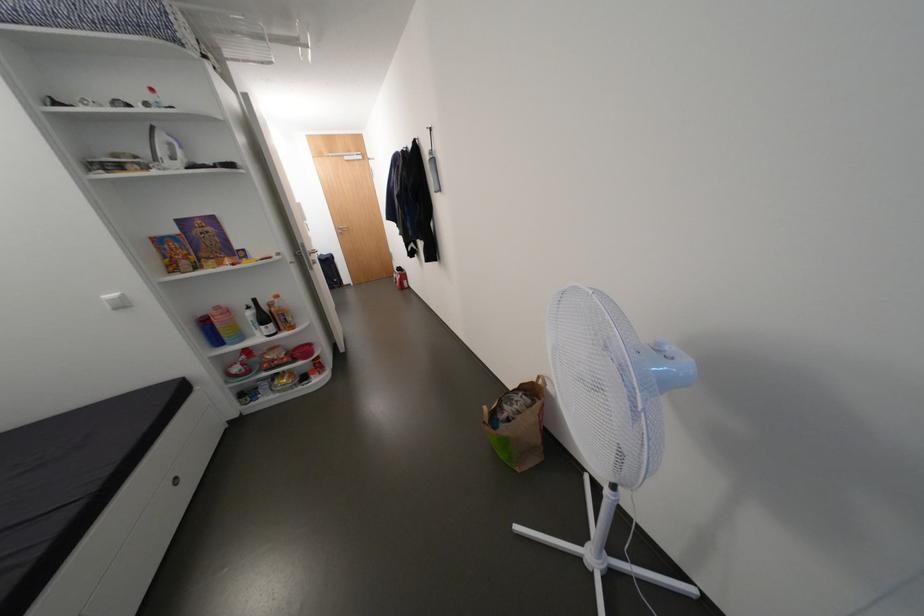
Which object does [517,424] point to?

It corresponds to the paper shopping bag in the image.